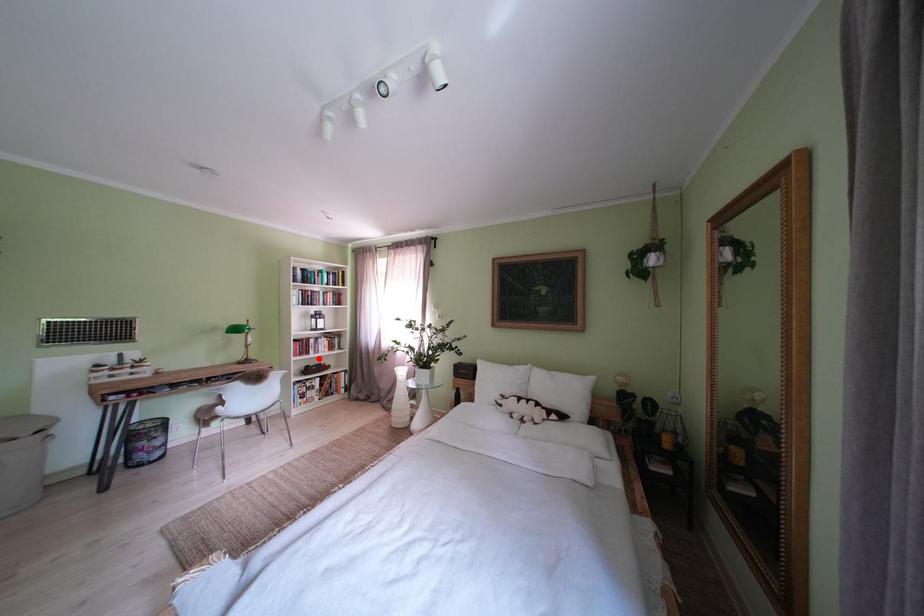
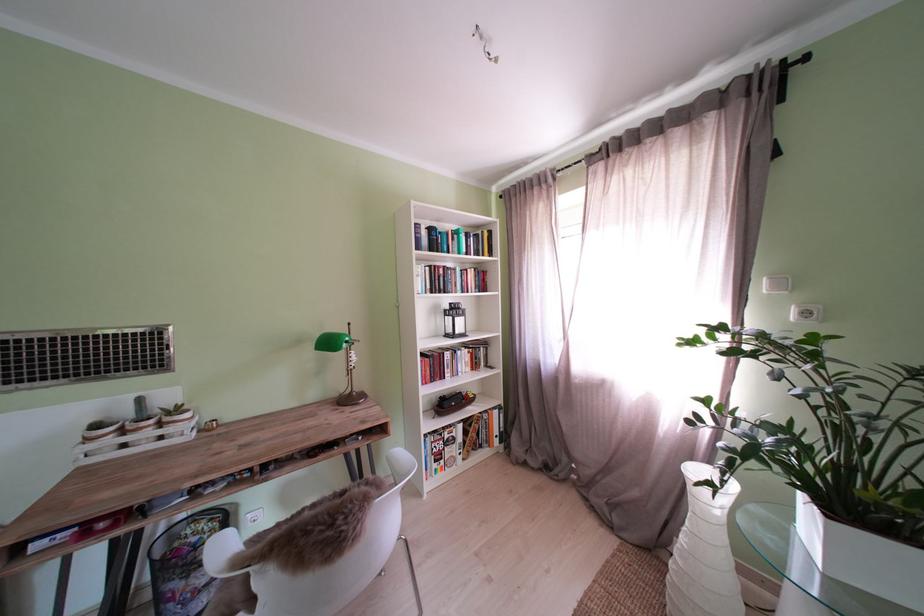
Question: I am providing you with two images of the same scene from different viewpoints. A red point is shown in image1. For the corresponding object point in image2, is it positioned nearer or farther from the camera?

Choices:
 (A) Nearer
 (B) Farther

Answer: (B)